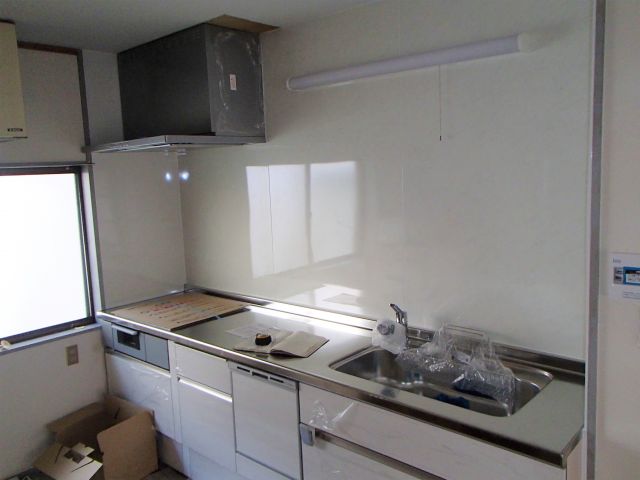
The height and width of the screenshot is (480, 640). Identify the location of cardboard box. (99, 457).